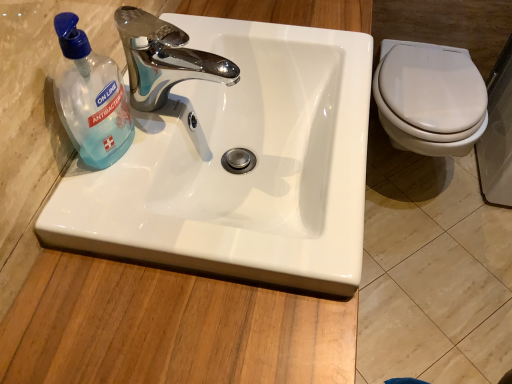
Find the location of a particular element. free location to the right of transparent plastic bottle at left is located at coordinates (164, 166).